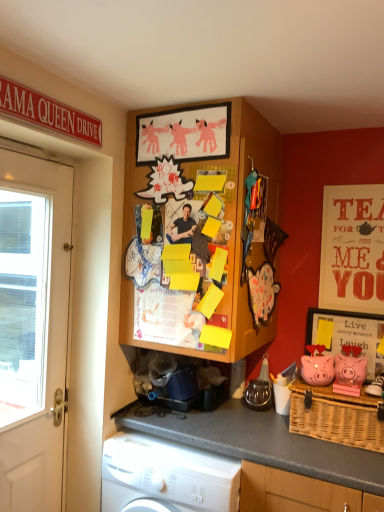
The width and height of the screenshot is (384, 512). What do you see at coordinates (167, 475) in the screenshot?
I see `white plastic washing machine at lower left` at bounding box center [167, 475].

This screenshot has height=512, width=384. Describe the element at coordinates (258, 395) in the screenshot. I see `metallic silver kettle at center` at that location.

How much space does wooden framed picture at right, positioned as the first picture frame in right-to-left order, occupy vertically?

wooden framed picture at right, positioned as the first picture frame in right-to-left order, is 12.70 inches tall.

Locate an element on the screen. The height and width of the screenshot is (512, 384). pink matte piggy bank at upper right, arranged as the 2th pig when viewed from the right is located at coordinates (317, 369).

Identify the location of washing machine located underneath the matte pink paper at upper center, acting as the 1th picture frame starting from the top (from a real-world perspective). (167, 475).

From a real-world perspective, between white plastic washing machine at lower left and matte pink paper at upper center, positioned as the first picture frame in left-to-right order, who is vertically lower?

white plastic washing machine at lower left, from a real-world perspective.

Is white plastic washing machine at lower left shorter than matte pink paper at upper center, which ranks as the second picture frame in bottom-to-top order?

No, white plastic washing machine at lower left is not shorter than matte pink paper at upper center, which ranks as the second picture frame in bottom-to-top order.

Would you say woven wicker picnic basket at lower right is part of white wooden door at left's contents?

No, white wooden door at left does not contain woven wicker picnic basket at lower right.

Considering the positions of objects white wooden door at left and woven wicker picnic basket at lower right in the image provided, who is behind, white wooden door at left or woven wicker picnic basket at lower right?

Positioned behind is woven wicker picnic basket at lower right.

Does white wooden door at left have a lesser height compared to woven wicker picnic basket at lower right?

No.

Looking at their sizes, would you say pink matte piggy bank at upper right, the 1th pig in the left-to-right sequence, is wider or thinner than metallic silver kettle at center?

pink matte piggy bank at upper right, the 1th pig in the left-to-right sequence, is thinner than metallic silver kettle at center.

Considering the relative sizes of pink matte piggy bank at upper right, the 1th pig in the left-to-right sequence, and metallic silver kettle at center in the image provided, is pink matte piggy bank at upper right, the 1th pig in the left-to-right sequence, taller than metallic silver kettle at center?

Indeed, pink matte piggy bank at upper right, the 1th pig in the left-to-right sequence, has a greater height compared to metallic silver kettle at center.

Could you measure the distance between pink matte piggy bank at upper right, the 1th pig in the left-to-right sequence, and metallic silver kettle at center?

pink matte piggy bank at upper right, the 1th pig in the left-to-right sequence, and metallic silver kettle at center are 13.65 inches apart from each other.

Does pink matte piggy bank at upper right, arranged as the 2th pig when viewed from the right, touch metallic silver kettle at center?

No, pink matte piggy bank at upper right, arranged as the 2th pig when viewed from the right, is not in contact with metallic silver kettle at center.

Which is more to the left, wooden board at upper center or white wooden door at left?

white wooden door at left is more to the left.

Who is smaller, wooden board at upper center or white wooden door at left?

With smaller size is white wooden door at left.

Does point (362, 221) appear closer or farther from the camera than point (322, 395)?

Point (362, 221) is positioned farther from the camera compared to point (322, 395).

Is matte red poster at upper right oriented away from woven wicker picnic basket at lower right?

That's not correct — matte red poster at upper right is not looking away from woven wicker picnic basket at lower right.

From a real-world perspective, is matte red poster at upper right physically above woven wicker picnic basket at lower right?

Indeed, from a real-world perspective, matte red poster at upper right stands above woven wicker picnic basket at lower right.

From a real-world perspective, between wooden board at upper center and metallic silver kettle at center, who is vertically higher?

wooden board at upper center, from a real-world perspective.

Which is nearer, [280,143] or [261,404]?

Point [261,404]

Image resolution: width=384 pixels, height=512 pixels. What are the coordinates of `appliance below the wooden board at upper center (from the image's perspective)` in the screenshot? It's located at (258, 395).

Locate an element on the screen. The height and width of the screenshot is (512, 384). advertisement located in front of the metallic silver kettle at center is located at coordinates (352, 248).

Is there a large distance between metallic silver kettle at center and matte red poster at upper right?

metallic silver kettle at center is actually quite close to matte red poster at upper right.

Considering the relative sizes of metallic silver kettle at center and matte red poster at upper right in the image provided, is metallic silver kettle at center bigger than matte red poster at upper right?

Actually, metallic silver kettle at center might be smaller than matte red poster at upper right.

Is metallic silver kettle at center turned away from matte red poster at upper right?

No.

What are the coordinates of `washing machine below the matte pink paper at upper center, acting as the 1th picture frame starting from the top (from a real-world perspective)` in the screenshot? It's located at (167, 475).

Locate an element on the screen. door in front of the woven wicker picnic basket at lower right is located at coordinates (34, 324).

Estimate the real-world distances between objects in this image. Which object is further from white plastic washing machine at lower left, pink matte piggy bank at right, which appears as the first pig when viewed from the right, or matte red poster at upper right?

Based on the image, matte red poster at upper right appears to be further to white plastic washing machine at lower left.

Which object lies nearer to the anchor point metallic silver kettle at center, pink matte piggy bank at right, the 2th pig from the left, or white plastic washing machine at lower left?

pink matte piggy bank at right, the 2th pig from the left, is closer to metallic silver kettle at center.

Based on their spatial positions, is metallic silver kettle at center or wooden board at upper center further from white plastic washing machine at lower left?

wooden board at upper center lies further to white plastic washing machine at lower left than the other object.

Looking at the image, which one is located closer to wooden board at upper center, matte red poster at upper right or wooden framed picture at right, the first picture frame viewed from the back?

matte red poster at upper right is closer to wooden board at upper center.

Considering their positions, is woven wicker picnic basket at lower right positioned further to wooden framed picture at right, the first picture frame viewed from the back, than pink matte piggy bank at upper right, arranged as the 2th pig when viewed from the right?

woven wicker picnic basket at lower right is further to wooden framed picture at right, the first picture frame viewed from the back.

Which object lies nearer to the anchor point woven wicker picnic basket at lower right, white wooden door at left or pink matte piggy bank at right, which appears as the first pig when viewed from the right?

pink matte piggy bank at right, which appears as the first pig when viewed from the right.

Considering their positions, is white wooden door at left positioned further to matte pink paper at upper center, acting as the first picture frame starting from the front, than pink matte piggy bank at right, the 2th pig from the left?

Among the two, pink matte piggy bank at right, the 2th pig from the left, is located further to matte pink paper at upper center, acting as the first picture frame starting from the front.

Based on their spatial positions, is wooden framed picture at right, placed as the first picture frame when sorted from bottom to top, or wooden board at upper center further from white wooden door at left?

wooden framed picture at right, placed as the first picture frame when sorted from bottom to top, is positioned further to the anchor white wooden door at left.

Where is `door between matte pink paper at upper center, which ranks as the second picture frame in bottom-to-top order, and metallic silver kettle at center, in the vertical direction`? This screenshot has width=384, height=512. door between matte pink paper at upper center, which ranks as the second picture frame in bottom-to-top order, and metallic silver kettle at center, in the vertical direction is located at coordinates (34, 324).

In order to click on door between matte pink paper at upper center, which is the second picture frame from right to left, and white plastic washing machine at lower left, in the vertical direction in this screenshot , I will do `click(34, 324)`.

Locate an element on the screen. picnic basket between white wooden door at left and pink matte piggy bank at right, the 2th pig from the left, in the horizontal direction is located at coordinates (336, 417).

Find the location of `cabinetry situated between white wooden door at left and wooden framed picture at right, the 2th picture frame when ordered from top to bottom, from left to right`. cabinetry situated between white wooden door at left and wooden framed picture at right, the 2th picture frame when ordered from top to bottom, from left to right is located at coordinates (204, 223).